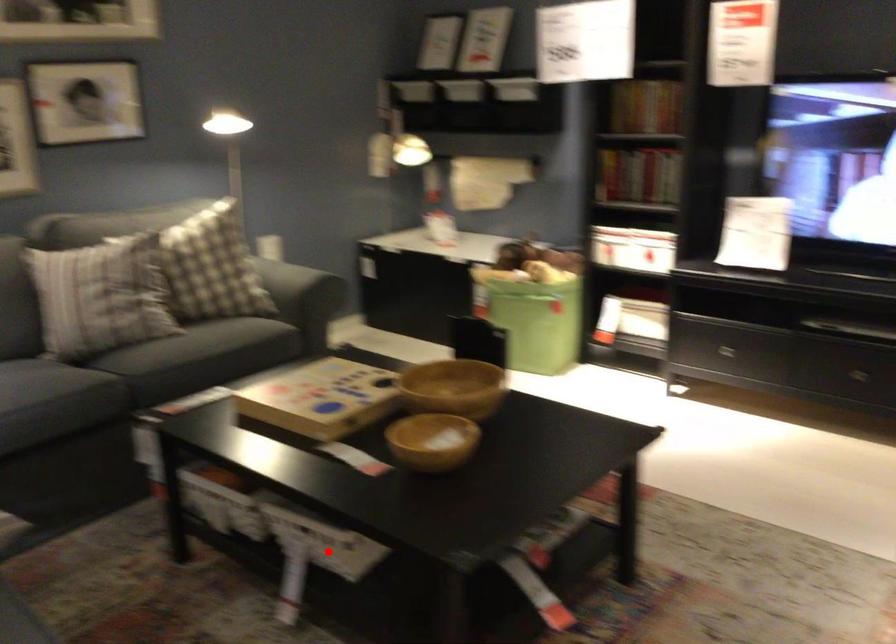
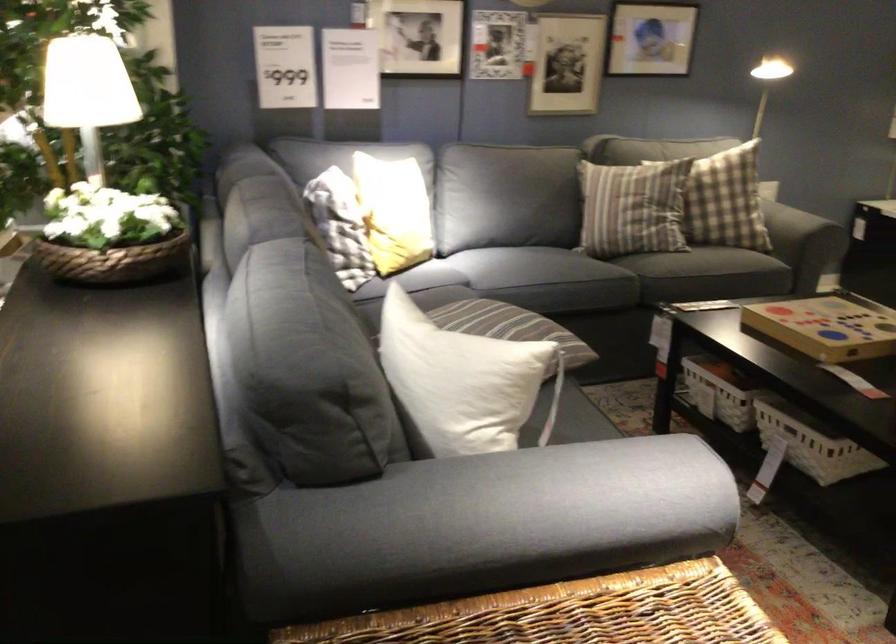
Find the pixel in the second image that matches the highlighted location in the first image.

(814, 448)